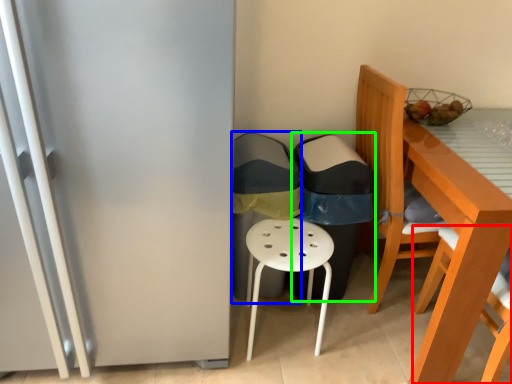
Question: Which object is positioned closest to chair (highlighted by a red box)? Select from garbage (highlighted by a blue box) and garbage (highlighted by a green box).

Choices:
 (A) garbage
 (B) garbage

Answer: (B)